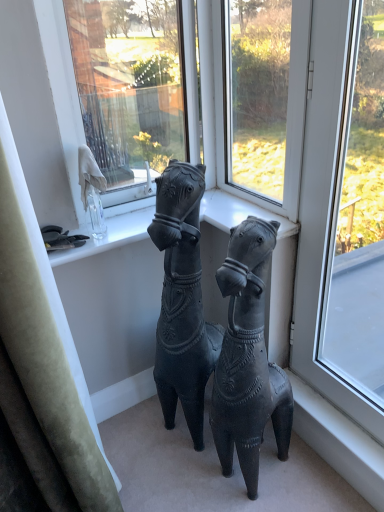
Question: Considering the positions of transparent glass window at center, placed as the second window when sorted from right to left, and transparent glass window at right, which is counted as the first window, starting from the right, in the image, is transparent glass window at center, placed as the second window when sorted from right to left, wider or thinner than transparent glass window at right, which is counted as the first window, starting from the right,?

Choices:
 (A) thin
 (B) wide

Answer: (B)

Question: Visually, is transparent glass window at center, marked as the 1th window in a left-to-right arrangement, positioned to the left or to the right of transparent glass window at right, which is counted as the first window, starting from the right?

Choices:
 (A) right
 (B) left

Answer: (B)

Question: Which of these objects is positioned farthest from the transparent glass window at center, marked as the 1th window in a left-to-right arrangement?

Choices:
 (A) matte black horse at center, acting as the 2th horse starting from the right
 (B) velvet green curtain at left
 (C) transparent glass window screen at upper center
 (D) matte black horse at center, positioned as the 2th horse in left-to-right order
 (E) transparent glass window at right, which is counted as the first window, starting from the right

Answer: (B)

Question: Which of these objects is positioned farthest from the velvet green curtain at left?

Choices:
 (A) transparent glass window screen at upper center
 (B) transparent glass window at right, which is counted as the first window, starting from the right
 (C) matte black horse at center, the 1th horse from the right
 (D) transparent glass window at center, marked as the 1th window in a left-to-right arrangement
 (E) matte black horse at center, acting as the 2th horse starting from the right

Answer: (A)